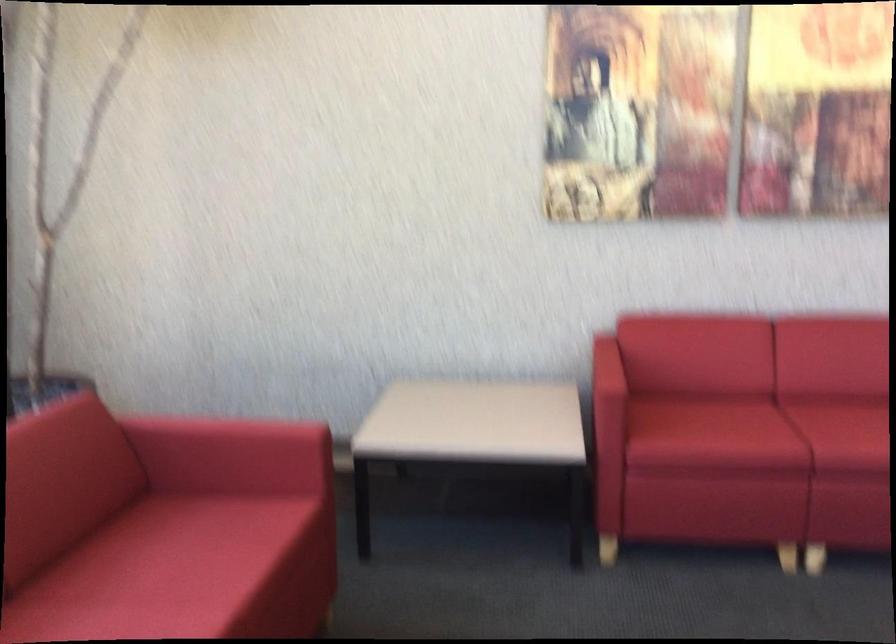
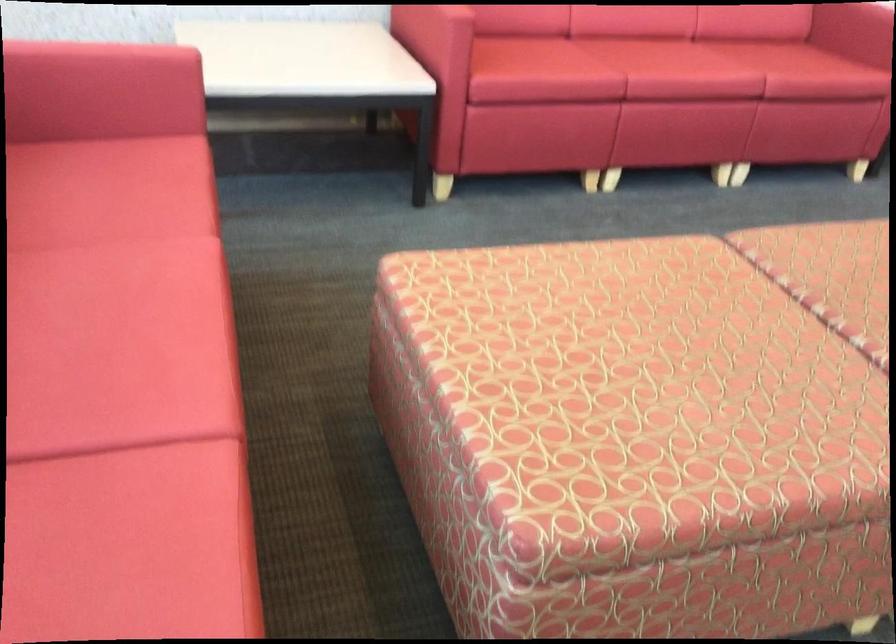
How did the camera likely rotate?

The rotation direction of the camera is right-down.